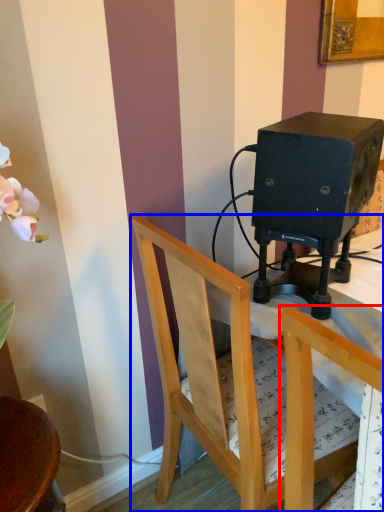
Question: Which point is closer to the camera, chair (highlighted by a red box) or chair (highlighted by a blue box)?

Choices:
 (A) chair
 (B) chair

Answer: (A)